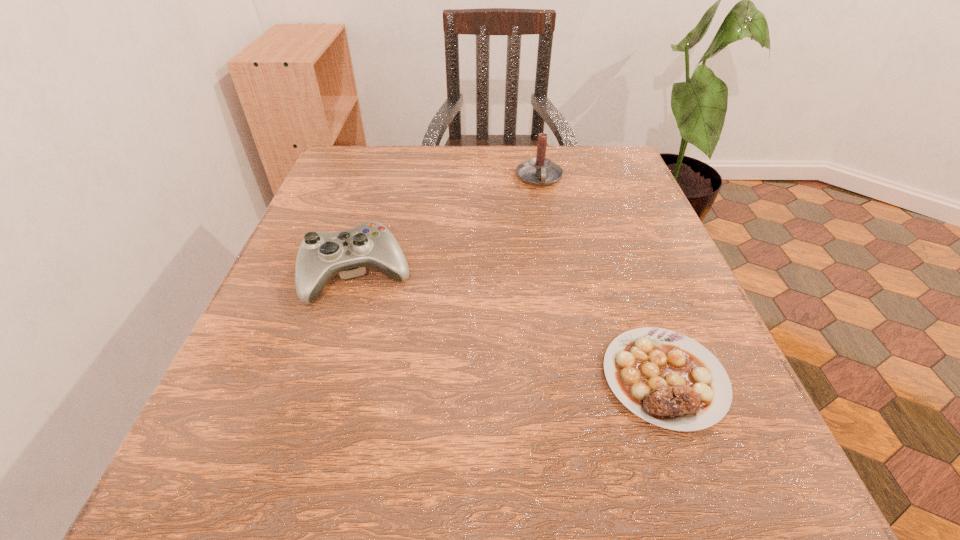
Identify the location of vacant area that lies between the steak and the farthest object. (602, 278).

Locate an element on the screen. The width and height of the screenshot is (960, 540). free space between the tallest object and the nearest object is located at coordinates (602, 278).

Where is `vacant region between the candle and the nearest object`? This screenshot has width=960, height=540. vacant region between the candle and the nearest object is located at coordinates (602, 278).

Locate an element on the screen. free area in between the second farthest object and the tallest object is located at coordinates (449, 227).

In order to click on empty space between the nearest object and the candle in this screenshot , I will do `click(602, 278)`.

Where is `free space between the farthest object and the control`? free space between the farthest object and the control is located at coordinates (449, 227).

This screenshot has width=960, height=540. What are the coordinates of `unoccupied area between the shortest object and the leftmost object` in the screenshot? It's located at (512, 327).

The width and height of the screenshot is (960, 540). Find the location of `vacant point located between the steak and the farthest object`. vacant point located between the steak and the farthest object is located at coordinates (602, 278).

The width and height of the screenshot is (960, 540). I want to click on empty space between the farthest object and the leftmost object, so click(449, 227).

Where is `blank region between the farthest object and the steak`? The height and width of the screenshot is (540, 960). blank region between the farthest object and the steak is located at coordinates (602, 278).